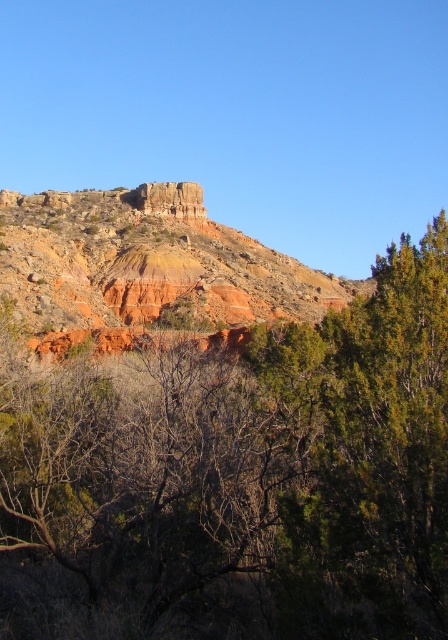
You are an explorer standing at the base of the cliff and see the green leafy tree at upper center and the rustic rock formation at center. Which object is nearer to you?

The green leafy tree at upper center is closer to the viewer than the rustic rock formation at center.

You are standing at the base of the cliff and want to reach the top. There are two points marked on the cliff face. One is at coordinates point (283,353) and the other at point (61,212). Which point is closer to you, the observer, as you look at the cliff?

Point (283,353) is closer to the viewer than point (61,212). Therefore, the point at coordinates point (283,353) is closer to you as you look at the cliff.

You are standing at the base of the cliff and want to take a photo of the rustic rock formation at center. There is a green leafy tree at upper right blocking part of your view. Which direction should you move to avoid the tree?

Move to the left to avoid the green leafy tree at upper right, as it is positioned to the right of the rustic rock formation at center.